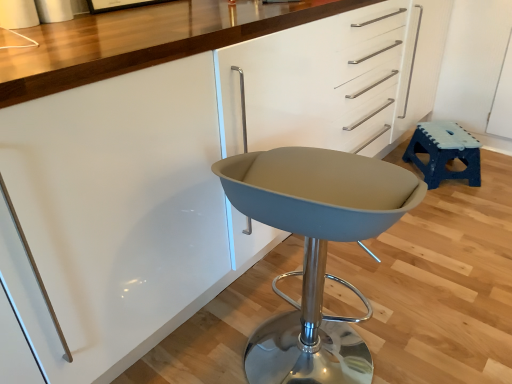
What are the coordinates of `free space between matte gray swivel chair at center and blue plastic stool at right` in the screenshot? It's located at (406, 259).